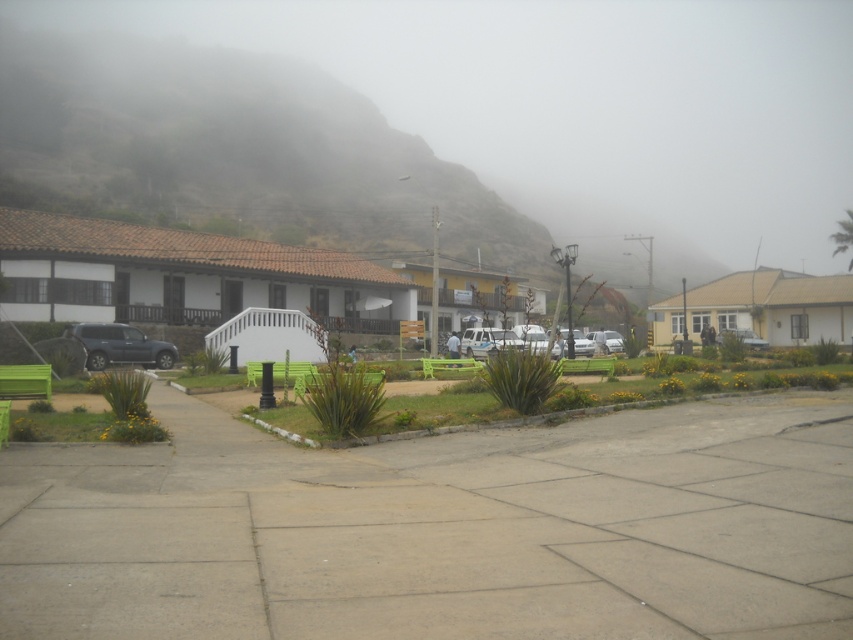
Based on the photo, is the position of white matte building at right less distant than that of metallic silver car at center-right?

No, white matte building at right is behind metallic silver car at center-right.

Is white matte building at right further to camera compared to metallic silver car at center-right?

Yes.

Describe the element at coordinates (775, 305) in the screenshot. The width and height of the screenshot is (853, 640). I see `white matte building at right` at that location.

Identify the location of white matte building at right. (775, 305).

Is point (134, 289) positioned behind point (724, 333)?

That is True.

Is white matte building at left positioned at the back of metallic silver car at center-right?

Yes, white matte building at left is further from the viewer.

Image resolution: width=853 pixels, height=640 pixels. Find the location of `white matte building at left`. white matte building at left is located at coordinates (183, 275).

Based on the photo, can you confirm if white matte building at right is shorter than satin black suv at center?

In fact, white matte building at right may be taller than satin black suv at center.

Is point (787, 282) farther from viewer compared to point (96, 336)?

Yes, it is.

Where is `white matte building at right`? white matte building at right is located at coordinates (775, 305).